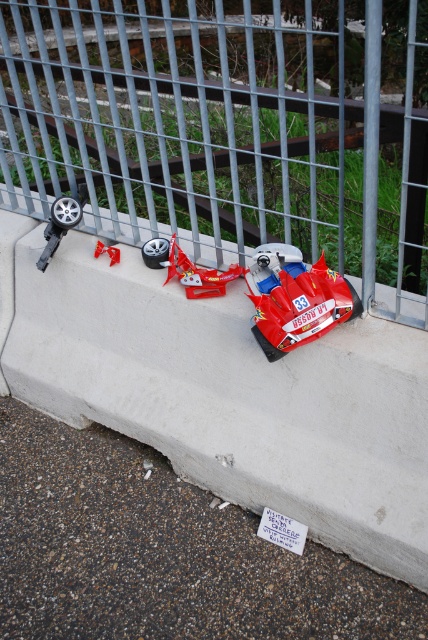
Question: Which point is closer to the camera taking this photo?

Choices:
 (A) (193, 513)
 (B) (101, 369)

Answer: (A)

Question: Is smooth concrete at center smaller than shiny red car at center?

Choices:
 (A) yes
 (B) no

Answer: (B)

Question: Is gray asphalt at lower center below shiny red plastic toy car at lower right?

Choices:
 (A) yes
 (B) no

Answer: (A)

Question: Where is smooth concrete at center located in relation to gray asphalt at lower center in the image?

Choices:
 (A) above
 (B) below

Answer: (A)

Question: Which object appears closest to the camera in this image?

Choices:
 (A) smooth concrete at center
 (B) shiny red plastic toy car at lower right
 (C) gray asphalt at lower center
 (D) shiny red car at center

Answer: (B)

Question: Which is nearer to the shiny red plastic toy car at lower right?

Choices:
 (A) shiny red car at center
 (B) metallic gray fence at upper center
 (C) smooth concrete at center
 (D) gray asphalt at lower center

Answer: (A)